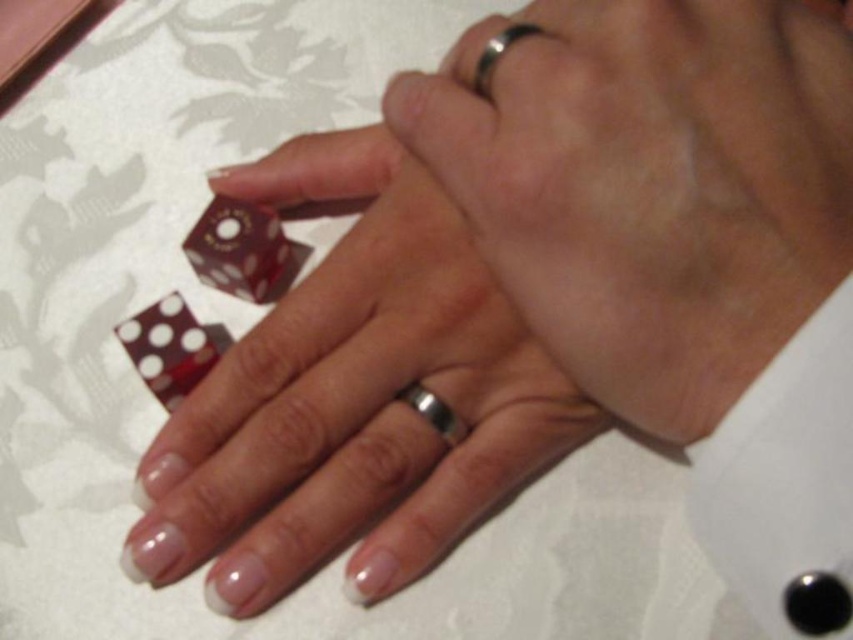
Consider the image. You are trying to reach the point at coordinates point (402, 388) with your hand. Given that your hand is currently at the position of the right hand in the image, can you reach it without moving your arm?

The point point (402, 388) is 14.97 inches away from the viewer. Since the right hand is positioned closer to the viewer, it can likely reach the point without moving the arm as the distance is within typical hand reach.